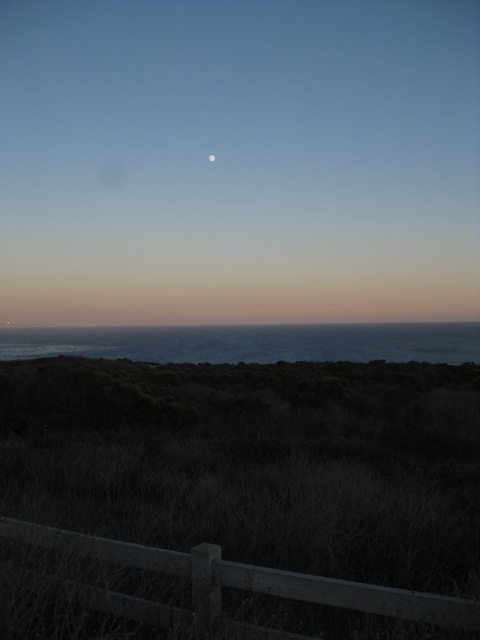
Is point (240, 358) positioned behind point (213, 157)?

No.

Which is above, blue water at center or white matte moon at upper center?

Positioned higher is white matte moon at upper center.

Describe the element at coordinates (252, 342) in the screenshot. I see `blue water at center` at that location.

Locate an element on the screen. Image resolution: width=480 pixels, height=640 pixels. blue water at center is located at coordinates (252, 342).

Between point (348, 596) and point (213, 160), which one is positioned in front?

Point (348, 596)

Who is taller, brown wooden fence at lower center or white matte moon at upper center?

white matte moon at upper center is taller.

Is point (90, 541) closer to camera compared to point (214, 160)?

Yes, it is in front of point (214, 160).

Image resolution: width=480 pixels, height=640 pixels. Find the location of `brown wooden fence at lower center`. brown wooden fence at lower center is located at coordinates (250, 579).

The image size is (480, 640). What do you see at coordinates (252, 342) in the screenshot?
I see `blue water at center` at bounding box center [252, 342].

Is blue water at center to the left of brown wooden fence at lower center from the viewer's perspective?

No, blue water at center is not to the left of brown wooden fence at lower center.

At what (x,y) coordinates should I click in order to perform the action: click on blue water at center. Please return your answer as a coordinate pair (x, y). This screenshot has height=640, width=480. Looking at the image, I should click on (252, 342).

You are a GUI agent. You are given a task and a screenshot of the screen. Output one action in this format:
    pyautogui.click(x=<x>, y=<y>)
    Task: Click on the blue water at center
    The width and height of the screenshot is (480, 640).
    Given the screenshot: What is the action you would take?
    pyautogui.click(x=252, y=342)